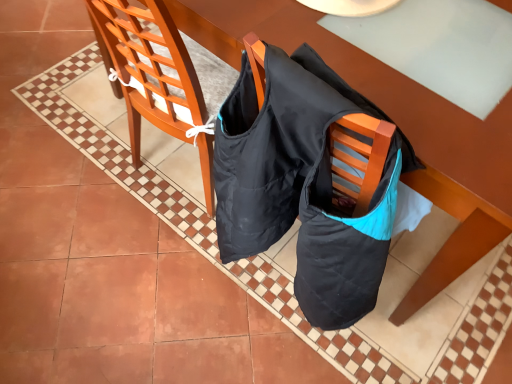
Question: Considering the positions of matte wood chair at left and matte wood table at center in the image, is matte wood chair at left bigger or smaller than matte wood table at center?

Choices:
 (A) small
 (B) big

Answer: (A)

Question: Looking at their shapes, would you say matte wood chair at left is wider or thinner than matte wood table at center?

Choices:
 (A) wide
 (B) thin

Answer: (B)

Question: In the image, is matte wood chair at left positioned in front of or behind matte wood table at center?

Choices:
 (A) behind
 (B) front

Answer: (B)

Question: In the image, is matte wood table at center on the left side or the right side of matte wood chair at left?

Choices:
 (A) left
 (B) right

Answer: (B)

Question: From a real-world perspective, relative to matte wood chair at left, is matte wood table at center vertically above or below?

Choices:
 (A) above
 (B) below

Answer: (B)

Question: Considering their positions, is matte wood table at center located in front of or behind matte wood chair at left?

Choices:
 (A) behind
 (B) front

Answer: (A)

Question: Does point tap(233, 16) appear closer or farther from the camera than point tap(97, 8)?

Choices:
 (A) farther
 (B) closer

Answer: (A)